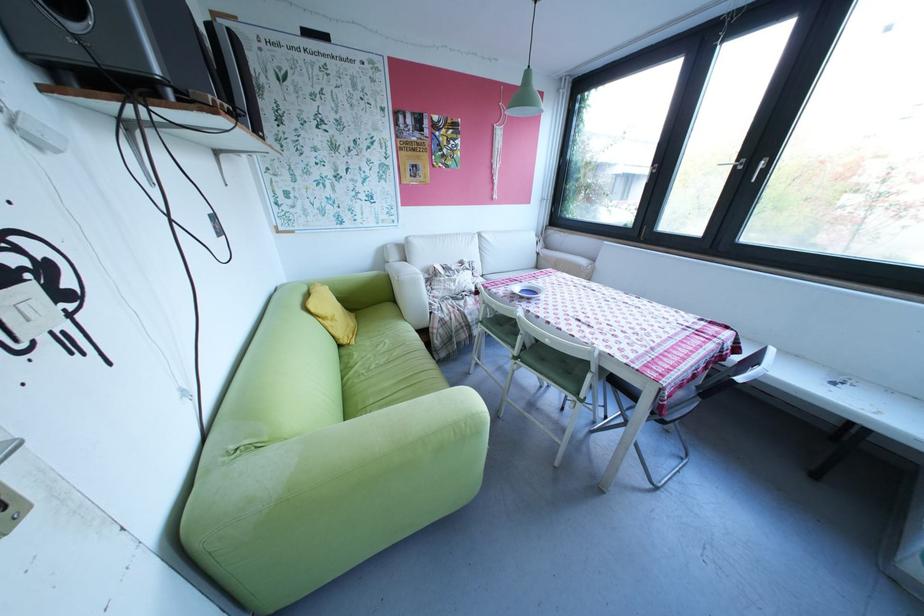
Find where to pull the silver window handle. Please return your answer as a coordinate pair (x, y).

(733, 163)